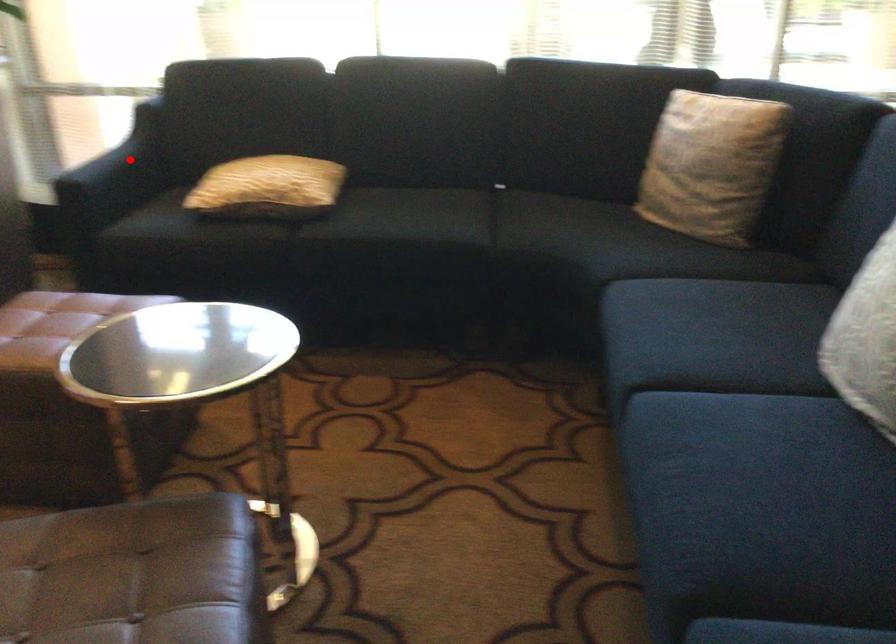
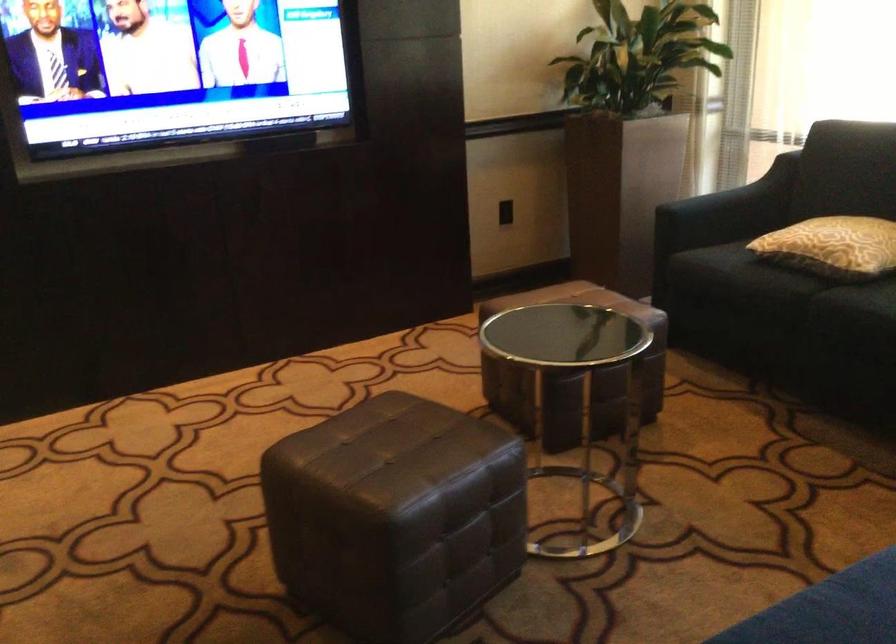
Question: I am providing you with two images of the same scene from different viewpoints. In image1, a red point is highlighted. Considering the same 3D point in image2, which of the following is correct?

Choices:
 (A) It is closer
 (B) It is farther

Answer: (B)